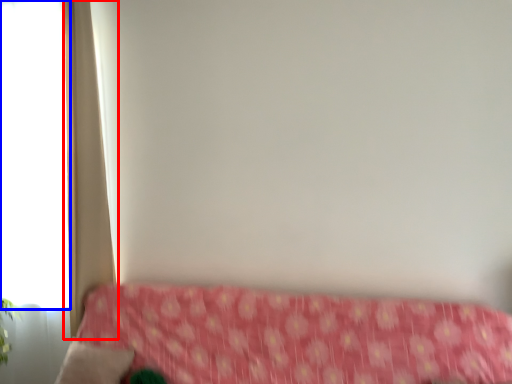
Question: Which object appears closest to the camera in this image, curtain (highlighted by a red box) or window (highlighted by a blue box)?

Choices:
 (A) curtain
 (B) window

Answer: (A)